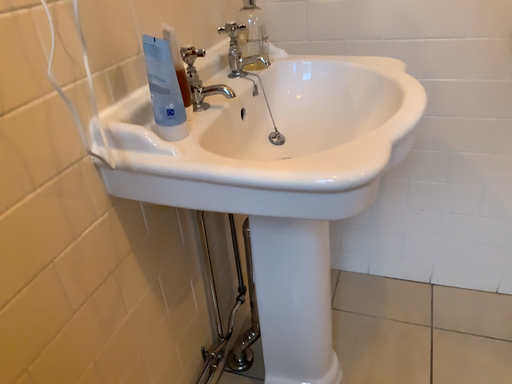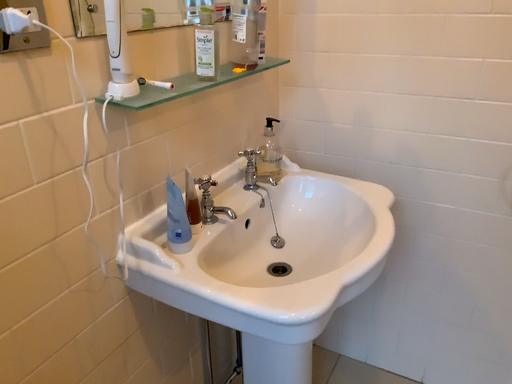
Question: Which way did the camera rotate in the video?

Choices:
 (A) rotated left
 (B) rotated right

Answer: (A)